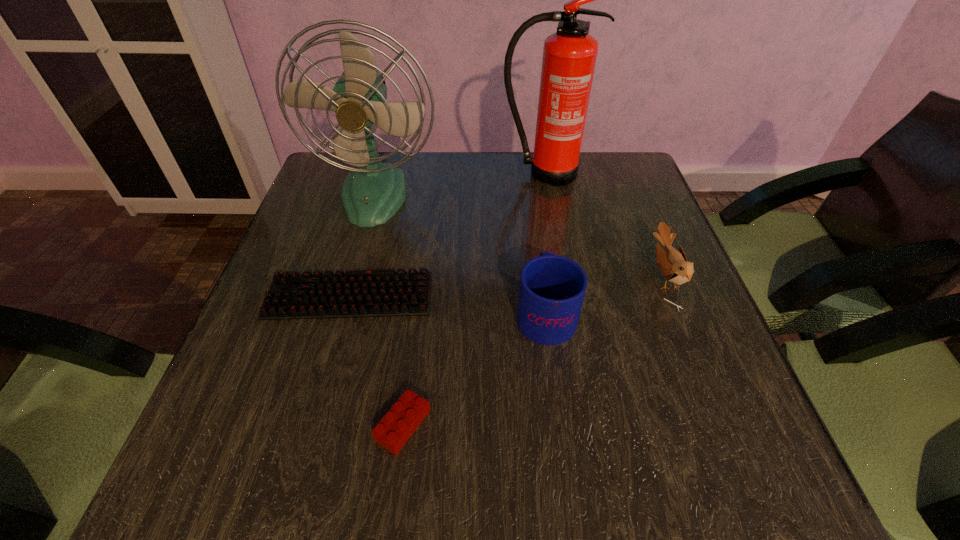
Find the location of a particular element. vacant position located on the side with the handle of the third tallest object is located at coordinates (537, 249).

The width and height of the screenshot is (960, 540). Find the location of `vacant area situated 0.100m on the side with the handle of the third tallest object`. vacant area situated 0.100m on the side with the handle of the third tallest object is located at coordinates click(x=537, y=249).

In order to click on vacant area located on the side with the handle of the third tallest object in this screenshot , I will do click(532, 207).

The height and width of the screenshot is (540, 960). Identify the location of vacant region located at the beak of the fourth tallest object. (589, 278).

Where is `blank area located at the beak of the fourth tallest object`? The image size is (960, 540). blank area located at the beak of the fourth tallest object is located at coordinates (628, 278).

Locate an element on the screen. This screenshot has width=960, height=540. vacant space situated 0.140m at the beak of the fourth tallest object is located at coordinates (585, 278).

Find the location of a particular element. The width and height of the screenshot is (960, 540). vacant position located on the right of the fifth tallest object is located at coordinates (629, 425).

The height and width of the screenshot is (540, 960). Find the location of `free space located on the back of the shortest object`. free space located on the back of the shortest object is located at coordinates (372, 213).

You are a GUI agent. You are given a task and a screenshot of the screen. Output one action in this format:
    pyautogui.click(x=<x>, y=<y>)
    Task: Click on the fire extinguisher that is positioned at the far edge
    
    Given the screenshot: What is the action you would take?
    pyautogui.click(x=569, y=56)

Where is `fan that is at the far edge`? The width and height of the screenshot is (960, 540). fan that is at the far edge is located at coordinates (371, 194).